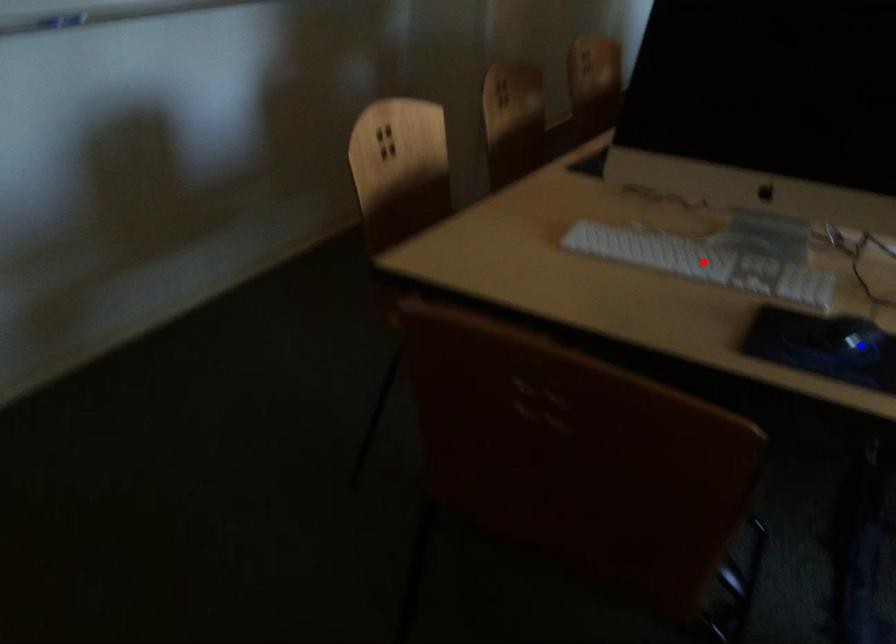
Question: Two points are marked on the image. Which point is closer to the camera?

Choices:
 (A) Blue point is closer.
 (B) Red point is closer.

Answer: (A)